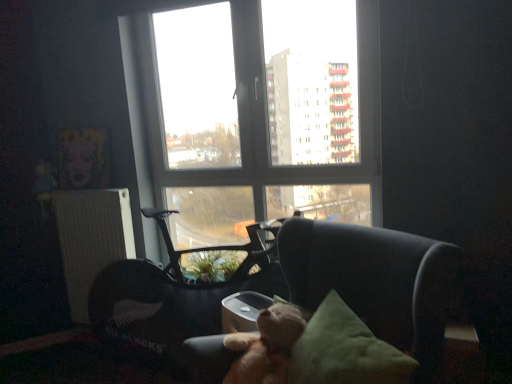
Question: From the image's perspective, is white textured radiator at left positioned above or below black plastic swivel chair at center?

Choices:
 (A) above
 (B) below

Answer: (A)

Question: Choose the correct answer: Is white textured radiator at left inside black plastic swivel chair at center or outside it?

Choices:
 (A) outside
 (B) inside

Answer: (A)

Question: Estimate the real-world distances between objects in this image. Which object is farther from the light brown plush at center?

Choices:
 (A) black plastic swivel chair at center
 (B) transparent glass window at center
 (C) dark gray leather chair at center
 (D) white textured radiator at left
 (E) green fabric pillow at center

Answer: (D)

Question: Which of these objects is positioned farthest from the black plastic swivel chair at center?

Choices:
 (A) dark gray leather chair at center
 (B) transparent glass window at center
 (C) white textured radiator at left
 (D) light brown plush at center
 (E) green fabric pillow at center

Answer: (E)